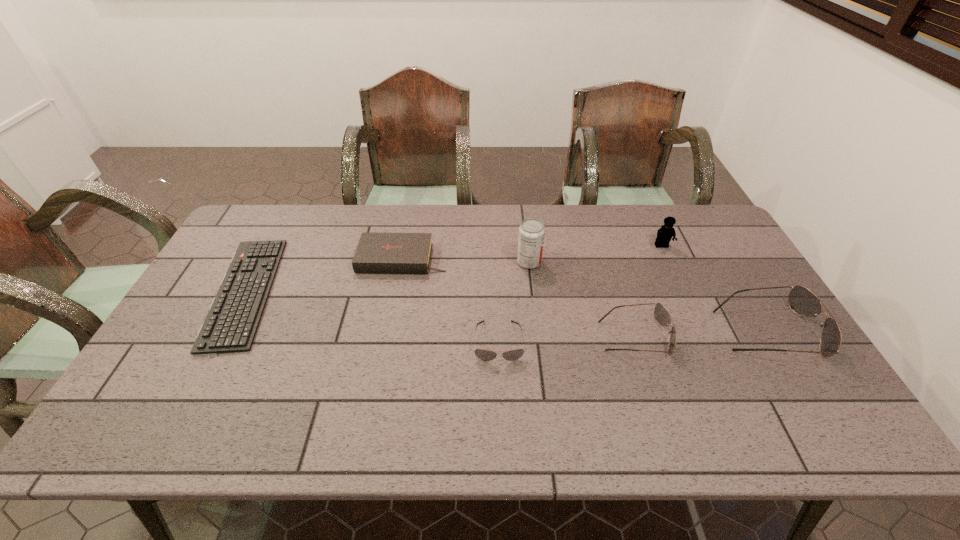
This screenshot has width=960, height=540. What are the coordinates of `Lego present at the far edge` in the screenshot? It's located at (664, 234).

Locate an element on the screen. Bible present at the far edge is located at coordinates (383, 253).

Where is `object that is positioned at the left edge`? object that is positioned at the left edge is located at coordinates (231, 324).

Find the location of a particular element. This screenshot has width=960, height=540. object positioned at the right edge is located at coordinates (803, 302).

Image resolution: width=960 pixels, height=540 pixels. Find the location of `object present at the far left corner`. object present at the far left corner is located at coordinates (231, 324).

Find the location of a particular element. vacant space at the far edge is located at coordinates (377, 216).

In the image, there is a desktop. Where is `blank space at the left edge`? Image resolution: width=960 pixels, height=540 pixels. blank space at the left edge is located at coordinates (211, 365).

Identify the location of blank space at the right edge. The width and height of the screenshot is (960, 540). (789, 359).

What are the coordinates of `vacant space at the far left corner` in the screenshot? It's located at (x=266, y=212).

I want to click on free location at the far right corner, so click(727, 244).